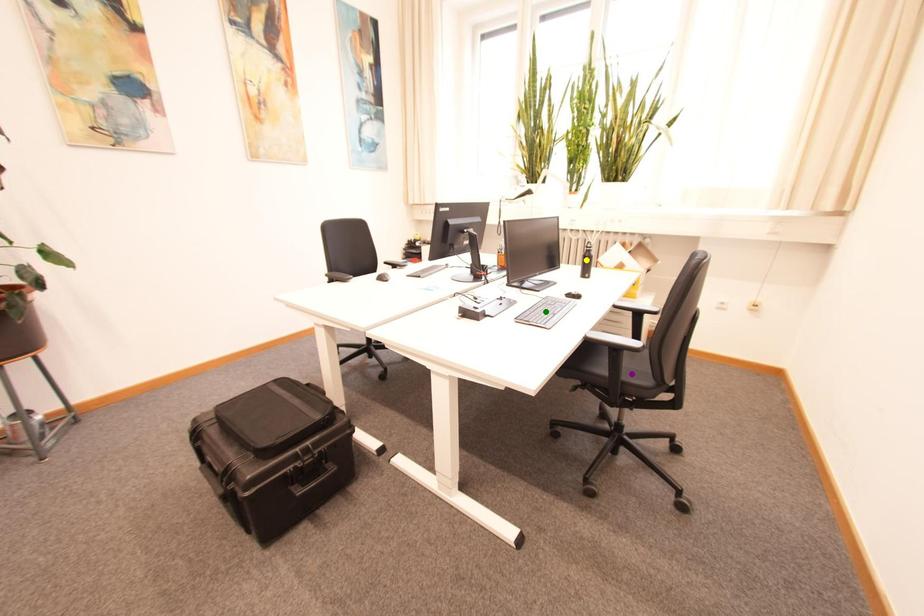
Order these from farthest to nearest:
- green point
- purple point
- yellow point

1. yellow point
2. green point
3. purple point